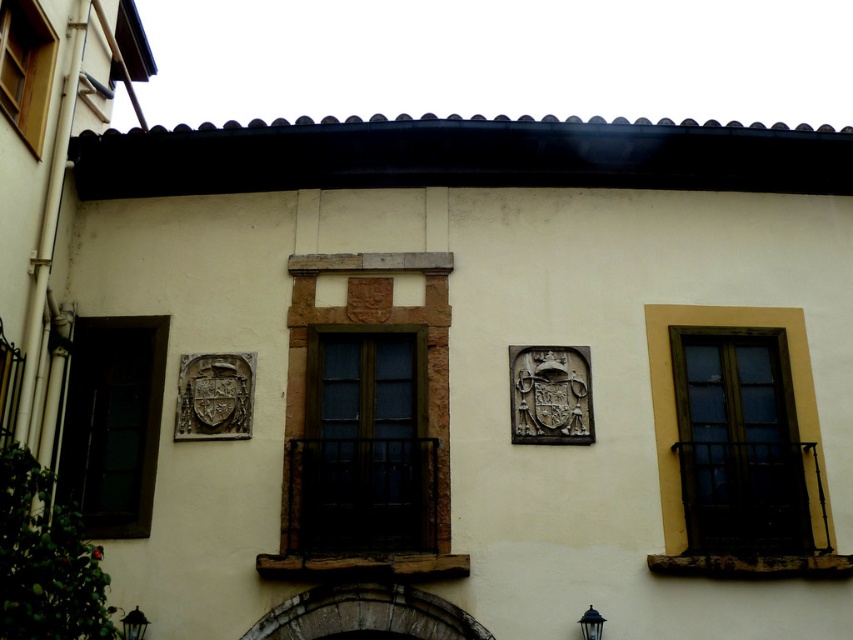
Question: Is the position of matte glass window at right more distant than that of dark glass window at left?

Choices:
 (A) yes
 (B) no

Answer: (B)

Question: Which of the following is the farthest from the observer?

Choices:
 (A) (384, 532)
 (B) (746, 387)
 (C) (13, 90)

Answer: (B)

Question: Can you confirm if brown wooden window at center is positioned above wooden window at upper left?

Choices:
 (A) no
 (B) yes

Answer: (A)

Question: Which point is farther to the camera?

Choices:
 (A) matte glass window at right
 (B) wooden window at upper left
 (C) brown wooden window at center
 (D) dark glass window at left

Answer: (D)

Question: From the image, what is the correct spatial relationship of brown wooden window at center in relation to dark glass window at left?

Choices:
 (A) below
 (B) above

Answer: (A)

Question: Which object is closer to the camera taking this photo?

Choices:
 (A) matte glass window at right
 (B) brown wooden window at center

Answer: (B)